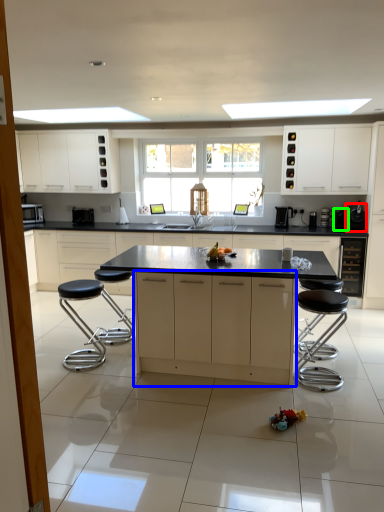
Question: Which object is the closest to the appliance (highlighted by a red box)? Choose among these: cabinetry (highlighted by a blue box) or appliance (highlighted by a green box).

Choices:
 (A) cabinetry
 (B) appliance

Answer: (B)